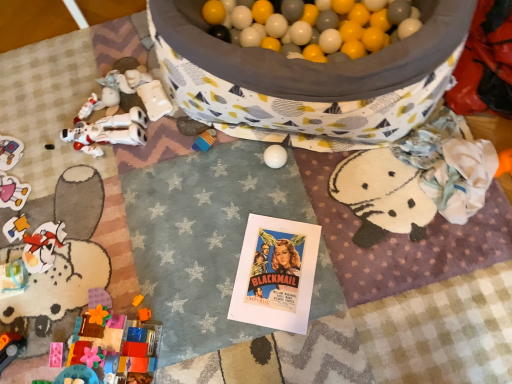
You are a GUI agent. You are given a task and a screenshot of the screen. Output one action in this format:
    pyautogui.click(x=<x>, y=<y>)
    Task: Click on the brick-like plastic blocks at lower left, arranged as the first toy when viewed from the front
    
    Given the screenshot: What is the action you would take?
    pyautogui.click(x=115, y=343)

In the scene shown: How much space does plastic toy car at lower left, placed as the fourth toy when sorted from front to back, occupy horizontally?

It is 20.94 centimeters.

At what (x,y) coordinates should I click in order to perform the action: click on plastic toy car at lower left, the 1th toy positioned from the back. Please return your answer as a coordinate pair (x, y). The height and width of the screenshot is (384, 512). Looking at the image, I should click on (10, 152).

Measure the distance between white matte robot at left, acting as the second toy starting from the back, and camera.

4.17 feet.

Where is `brick-like plastic blocks at lower left, placed as the third toy when sorted from top to bottom`? The width and height of the screenshot is (512, 384). brick-like plastic blocks at lower left, placed as the third toy when sorted from top to bottom is located at coordinates (115, 343).

Would you consider orange plastic car at lower left, the 2th toy viewed from the front, to be distant from brick-like plastic blocks at lower left, which is counted as the 2th toy, starting from the bottom?

No, orange plastic car at lower left, the 2th toy viewed from the front, is in close proximity to brick-like plastic blocks at lower left, which is counted as the 2th toy, starting from the bottom.

Is orange plastic car at lower left, the 2th toy viewed from the front, positioned with its back to brick-like plastic blocks at lower left, placed as the third toy when sorted from top to bottom?

No, brick-like plastic blocks at lower left, placed as the third toy when sorted from top to bottom, is not at the back of orange plastic car at lower left, the 2th toy viewed from the front.

From the image's perspective, count 1st toys upward from the orange plastic car at lower left, which ranks as the 1th toy in bottom-to-top order, and point to it. Please provide its 2D coordinates.

[(115, 343)]

Measure the distance from orange plastic car at lower left, the 3th toy from the back, to brick-like plastic blocks at lower left, which appears as the 4th toy when viewed from the back.

orange plastic car at lower left, the 3th toy from the back, and brick-like plastic blocks at lower left, which appears as the 4th toy when viewed from the back, are 13.85 inches apart from each other.

This screenshot has width=512, height=384. Find the location of `toy that appears above the plastic toy car at lower left, the 1th toy positioned from the back (from the image's perspective)`. toy that appears above the plastic toy car at lower left, the 1th toy positioned from the back (from the image's perspective) is located at coordinates (108, 132).

Considering the sizes of objects white matte robot at left, the fourth toy positioned from the bottom, and plastic toy car at lower left, placed as the fourth toy when sorted from front to back, in the image provided, who is thinner, white matte robot at left, the fourth toy positioned from the bottom, or plastic toy car at lower left, placed as the fourth toy when sorted from front to back,?

Thinner between the two is plastic toy car at lower left, placed as the fourth toy when sorted from front to back.

Would you say plastic toy car at lower left, placed as the fourth toy when sorted from front to back, is part of white matte robot at left, which is the first toy in top-to-bottom order,'s contents?

No.

From the image's perspective, does brick-like plastic blocks at lower left, which is counted as the 2th toy, starting from the bottom, appear lower than orange plastic car at lower left, the 3th toy from the back?

No.

Is brick-like plastic blocks at lower left, which appears as the 4th toy when viewed from the back, facing away from orange plastic car at lower left, the 2th toy viewed from the front?

That's right, brick-like plastic blocks at lower left, which appears as the 4th toy when viewed from the back, is facing away from orange plastic car at lower left, the 2th toy viewed from the front.

From a real-world perspective, between brick-like plastic blocks at lower left, placed as the third toy when sorted from top to bottom, and orange plastic car at lower left, the 2th toy viewed from the front, who is vertically lower?

From a 3D spatial view, orange plastic car at lower left, the 2th toy viewed from the front, is below.

Considering the sizes of objects brick-like plastic blocks at lower left, placed as the third toy when sorted from top to bottom, and orange plastic car at lower left, the 2th toy viewed from the front, in the image provided, who is taller, brick-like plastic blocks at lower left, placed as the third toy when sorted from top to bottom, or orange plastic car at lower left, the 2th toy viewed from the front,?

With more height is brick-like plastic blocks at lower left, placed as the third toy when sorted from top to bottom.

Which of these two, white matte robot at left, the third toy positioned from the front, or brick-like plastic blocks at lower left, which appears as the 4th toy when viewed from the back, is bigger?

brick-like plastic blocks at lower left, which appears as the 4th toy when viewed from the back.

In the scene shown: From a real-world perspective, is white matte robot at left, the fourth toy positioned from the bottom, located beneath brick-like plastic blocks at lower left, arranged as the first toy when viewed from the front?

Yes.

How much distance is there between white matte robot at left, the third toy positioned from the front, and brick-like plastic blocks at lower left, which appears as the 4th toy when viewed from the back?

The distance of white matte robot at left, the third toy positioned from the front, from brick-like plastic blocks at lower left, which appears as the 4th toy when viewed from the back, is 21.60 inches.

Between white matte robot at left, the fourth toy positioned from the bottom, and brick-like plastic blocks at lower left, which appears as the 4th toy when viewed from the back, which one has smaller width?

brick-like plastic blocks at lower left, which appears as the 4th toy when viewed from the back, is thinner.

Does brick-like plastic blocks at lower left, which is counted as the 2th toy, starting from the bottom, have a larger size compared to white matte robot at left, the third toy positioned from the front?

Indeed, brick-like plastic blocks at lower left, which is counted as the 2th toy, starting from the bottom, has a larger size compared to white matte robot at left, the third toy positioned from the front.

Between brick-like plastic blocks at lower left, which appears as the 4th toy when viewed from the back, and white matte robot at left, the fourth toy positioned from the bottom, which one has more height?

brick-like plastic blocks at lower left, which appears as the 4th toy when viewed from the back.

Considering the sizes of objects brick-like plastic blocks at lower left, which is counted as the 2th toy, starting from the bottom, and white matte robot at left, acting as the second toy starting from the back, in the image provided, who is wider, brick-like plastic blocks at lower left, which is counted as the 2th toy, starting from the bottom, or white matte robot at left, acting as the second toy starting from the back,?

white matte robot at left, acting as the second toy starting from the back.

Looking at this image, looking at their sizes, would you say plastic toy car at lower left, which is counted as the 2th toy, starting from the top, is wider or thinner than brick-like plastic blocks at lower left, placed as the third toy when sorted from top to bottom?

Considering their sizes, plastic toy car at lower left, which is counted as the 2th toy, starting from the top, looks slimmer than brick-like plastic blocks at lower left, placed as the third toy when sorted from top to bottom.

In the scene shown: From a real-world perspective, between plastic toy car at lower left, which ranks as the 3th toy in bottom-to-top order, and brick-like plastic blocks at lower left, placed as the third toy when sorted from top to bottom, who is vertically lower?

plastic toy car at lower left, which ranks as the 3th toy in bottom-to-top order, from a real-world perspective.

Which is in front, point (3, 162) or point (91, 360)?

The point (91, 360) is more forward.

Is plastic toy car at lower left, placed as the fourth toy when sorted from front to back, facing towards brick-like plastic blocks at lower left, which appears as the 4th toy when viewed from the back?

No, plastic toy car at lower left, placed as the fourth toy when sorted from front to back, is not turned towards brick-like plastic blocks at lower left, which appears as the 4th toy when viewed from the back.

Measure the distance between brick-like plastic blocks at lower left, which appears as the 4th toy when viewed from the back, and plastic toy car at lower left, which is counted as the 2th toy, starting from the top.

brick-like plastic blocks at lower left, which appears as the 4th toy when viewed from the back, is 26.97 inches from plastic toy car at lower left, which is counted as the 2th toy, starting from the top.

Considering the points (121, 341) and (0, 143), which point is in front, point (121, 341) or point (0, 143)?

Positioned in front is point (121, 341).

Between brick-like plastic blocks at lower left, placed as the third toy when sorted from top to bottom, and plastic toy car at lower left, the 1th toy positioned from the back, which one has more height?

With more height is brick-like plastic blocks at lower left, placed as the third toy when sorted from top to bottom.

At what (x,y) coordinates should I click in order to perform the action: click on the 3rd toy to the right of the plastic toy car at lower left, which ranks as the 3th toy in bottom-to-top order, counting from the anchor's position. Please return your answer as a coordinate pair (x, y). Looking at the image, I should click on (115, 343).

Where is `the 2nd toy counting from the right side of the orange plastic car at lower left, the 2th toy viewed from the front`? This screenshot has width=512, height=384. the 2nd toy counting from the right side of the orange plastic car at lower left, the 2th toy viewed from the front is located at coordinates (115, 343).

Which toy is the 1st one when counting from the front of the plastic toy car at lower left, which ranks as the 3th toy in bottom-to-top order? Please provide its 2D coordinates.

[(108, 132)]

Considering their positions, is white matte robot at left, acting as the second toy starting from the back, positioned closer to plastic toy car at lower left, which is counted as the 2th toy, starting from the top, than orange plastic car at lower left, the 3th toy from the back?

white matte robot at left, acting as the second toy starting from the back, lies closer to plastic toy car at lower left, which is counted as the 2th toy, starting from the top, than the other object.

Based on their spatial positions, is orange plastic car at lower left, which ranks as the 1th toy in bottom-to-top order, or white matte robot at left, acting as the second toy starting from the back, closer to brick-like plastic blocks at lower left, placed as the third toy when sorted from top to bottom?

The object closer to brick-like plastic blocks at lower left, placed as the third toy when sorted from top to bottom, is orange plastic car at lower left, which ranks as the 1th toy in bottom-to-top order.

Which object lies further to the anchor point white matte robot at left, the fourth toy positioned from the bottom, plastic toy car at lower left, placed as the fourth toy when sorted from front to back, or orange plastic car at lower left, the 2th toy viewed from the front?

Based on the image, orange plastic car at lower left, the 2th toy viewed from the front, appears to be further to white matte robot at left, the fourth toy positioned from the bottom.

Looking at this image, estimate the real-world distances between objects in this image. Which object is closer to plastic toy car at lower left, placed as the fourth toy when sorted from front to back, brick-like plastic blocks at lower left, which appears as the 4th toy when viewed from the back, or orange plastic car at lower left, the 2th toy viewed from the front?

orange plastic car at lower left, the 2th toy viewed from the front, lies closer to plastic toy car at lower left, placed as the fourth toy when sorted from front to back, than the other object.

Estimate the real-world distances between objects in this image. Which object is further from brick-like plastic blocks at lower left, placed as the third toy when sorted from top to bottom, plastic toy car at lower left, which ranks as the 3th toy in bottom-to-top order, or white matte robot at left, the fourth toy positioned from the bottom?

plastic toy car at lower left, which ranks as the 3th toy in bottom-to-top order.

When comparing their distances from plastic toy car at lower left, which ranks as the 3th toy in bottom-to-top order, does brick-like plastic blocks at lower left, arranged as the first toy when viewed from the front, or white matte robot at left, the third toy positioned from the front, seem further?

brick-like plastic blocks at lower left, arranged as the first toy when viewed from the front, lies further to plastic toy car at lower left, which ranks as the 3th toy in bottom-to-top order, than the other object.

From the image, which object appears to be farther from orange plastic car at lower left, which ranks as the 1th toy in bottom-to-top order, brick-like plastic blocks at lower left, which is counted as the 2th toy, starting from the bottom, or plastic toy car at lower left, which ranks as the 3th toy in bottom-to-top order?

plastic toy car at lower left, which ranks as the 3th toy in bottom-to-top order, lies further to orange plastic car at lower left, which ranks as the 1th toy in bottom-to-top order, than the other object.

Looking at this image, estimate the real-world distances between objects in this image. Which object is further from white matte robot at left, the third toy positioned from the front, brick-like plastic blocks at lower left, arranged as the first toy when viewed from the front, or plastic toy car at lower left, which ranks as the 3th toy in bottom-to-top order?

brick-like plastic blocks at lower left, arranged as the first toy when viewed from the front, lies further to white matte robot at left, the third toy positioned from the front, than the other object.

Identify the location of toy between plastic toy car at lower left, the 1th toy positioned from the back, and orange plastic car at lower left, which ranks as the 1th toy in bottom-to-top order, vertically. (115, 343).